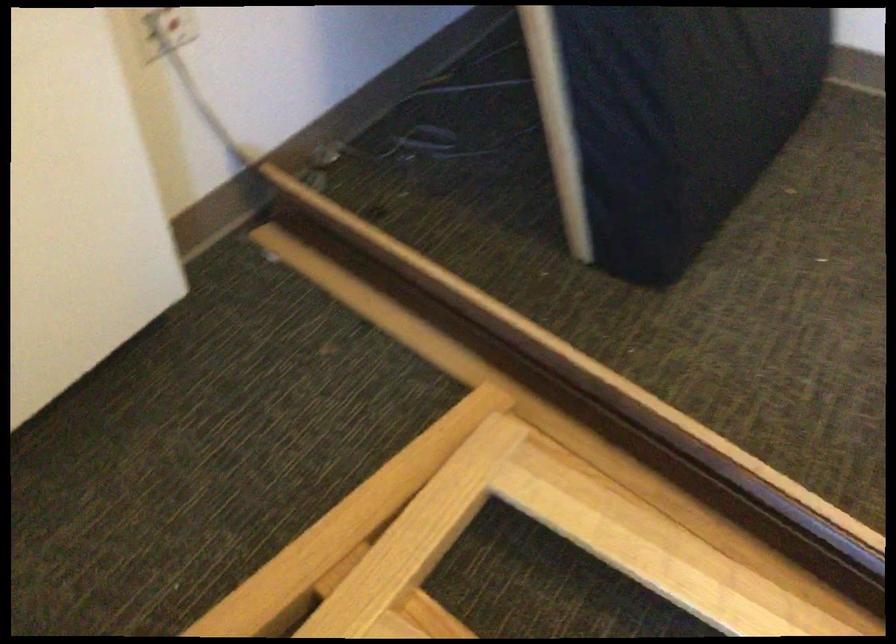
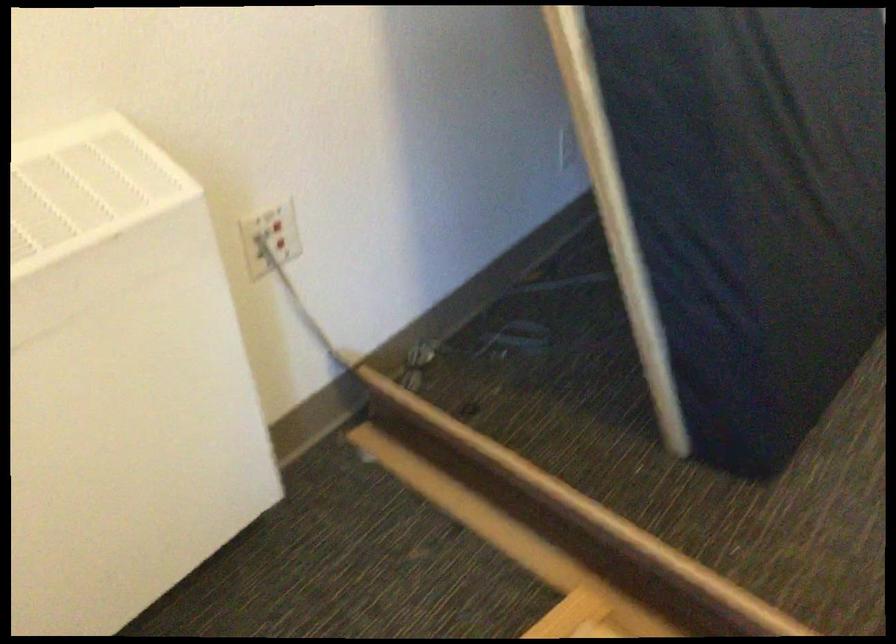
The point at (323, 166) is marked in the first image. Where is the corresponding point in the second image?

(418, 363)